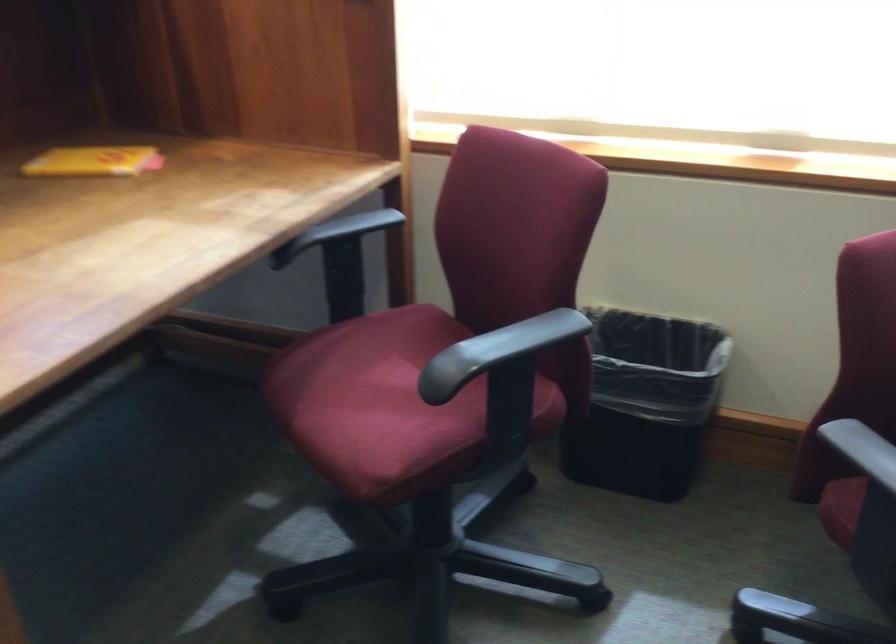
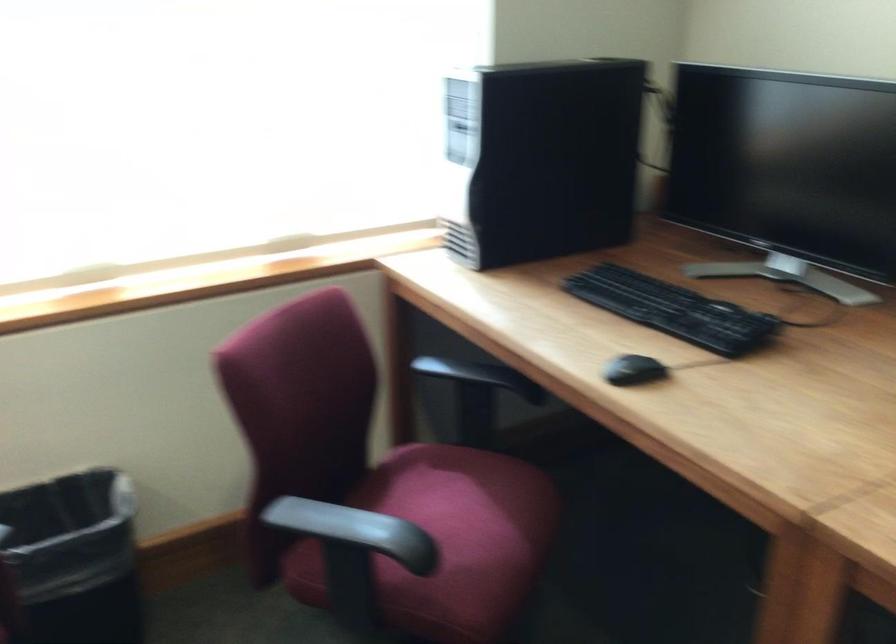
Question: How did the camera likely rotate?

Choices:
 (A) Left
 (B) Right
 (C) Up
 (D) Down

Answer: (B)